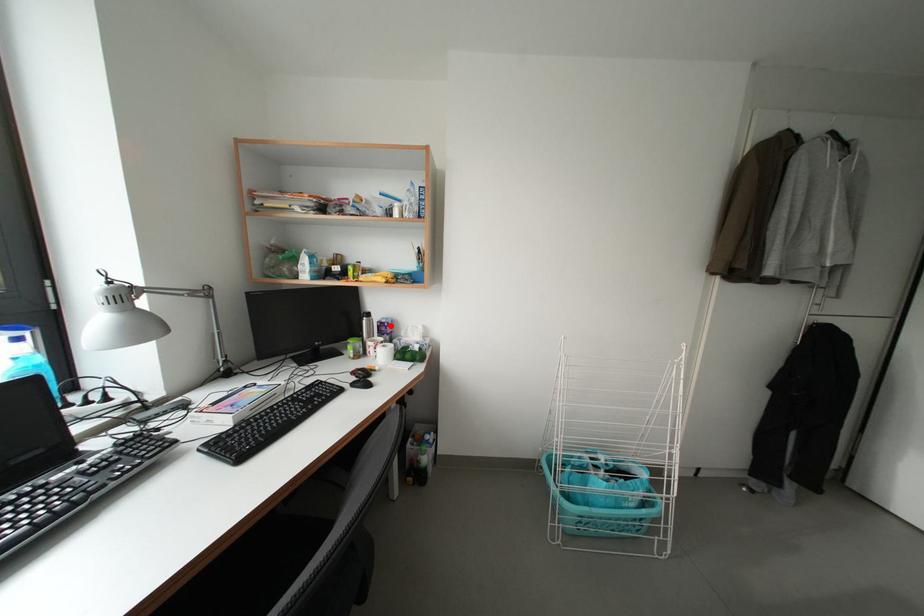
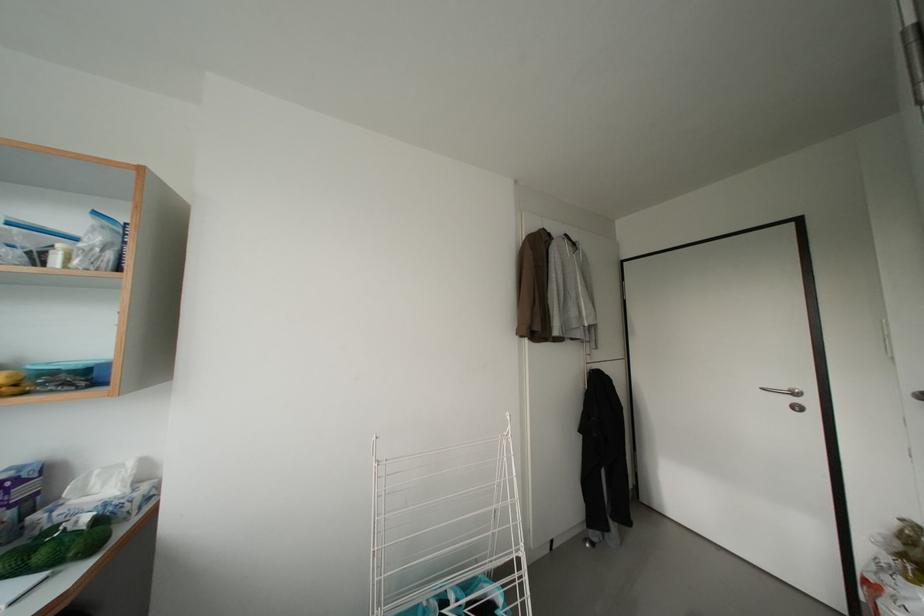
Find the pixel in the second image that matches the highlighted location in the first image.

(11, 482)